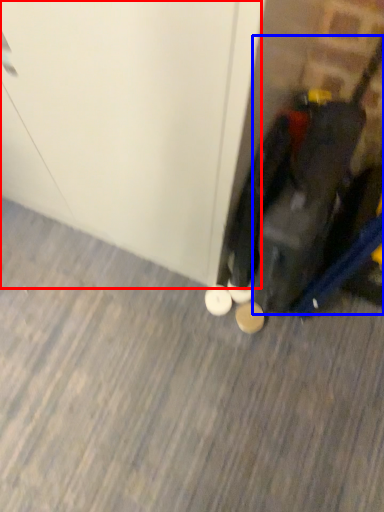
Question: Among these objects, which one is nearest to the camera, door (highlighted by a red box) or luggage (highlighted by a blue box)?

Choices:
 (A) door
 (B) luggage

Answer: (A)